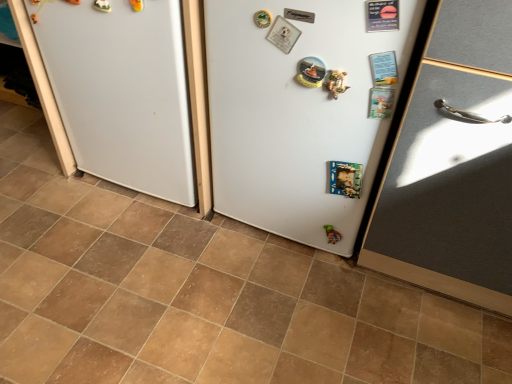
Question: Is matte gray door at right shorter than brown tile at center?

Choices:
 (A) yes
 (B) no

Answer: (B)

Question: Is brown tile at center inside matte gray door at right?

Choices:
 (A) yes
 (B) no

Answer: (B)

Question: From the image's perspective, does matte gray door at right appear lower than brown tile at center?

Choices:
 (A) no
 (B) yes

Answer: (A)

Question: Is the depth of matte gray door at right greater than that of brown tile at center?

Choices:
 (A) no
 (B) yes

Answer: (A)

Question: Can you confirm if matte gray door at right is bigger than brown tile at center?

Choices:
 (A) no
 (B) yes

Answer: (B)

Question: From a real-world perspective, is white matte refrigerator at center, acting as the 2th fridge starting from the left, above or below matte gray door at right?

Choices:
 (A) above
 (B) below

Answer: (B)

Question: Considering the positions of white matte refrigerator at center, acting as the 2th fridge starting from the left, and matte gray door at right in the image, is white matte refrigerator at center, acting as the 2th fridge starting from the left, bigger or smaller than matte gray door at right?

Choices:
 (A) small
 (B) big

Answer: (B)

Question: Is point (239, 38) positioned closer to the camera than point (500, 148)?

Choices:
 (A) farther
 (B) closer

Answer: (A)

Question: Is white matte refrigerator at center, acting as the 2th fridge starting from the left, inside the boundaries of matte gray door at right, or outside?

Choices:
 (A) inside
 (B) outside

Answer: (B)

Question: Is green matte toy at lower center wider or thinner than white matte refrigerator at center, arranged as the second fridge when viewed from the right?

Choices:
 (A) thin
 (B) wide

Answer: (A)

Question: From the image's perspective, is green matte toy at lower center positioned above or below white matte refrigerator at center, arranged as the second fridge when viewed from the right?

Choices:
 (A) above
 (B) below

Answer: (B)

Question: Is green matte toy at lower center in front of or behind white matte refrigerator at center, arranged as the second fridge when viewed from the right, in the image?

Choices:
 (A) behind
 (B) front

Answer: (A)

Question: In terms of height, does green matte toy at lower center look taller or shorter compared to white matte refrigerator at center, arranged as the second fridge when viewed from the right?

Choices:
 (A) tall
 (B) short

Answer: (B)

Question: Visually, is brown tile at center positioned to the left or to the right of white matte refrigerator at center, acting as the 2th fridge starting from the left?

Choices:
 (A) left
 (B) right

Answer: (A)

Question: In terms of size, does brown tile at center appear bigger or smaller than white matte refrigerator at center, the 1th fridge when ordered from right to left?

Choices:
 (A) small
 (B) big

Answer: (A)